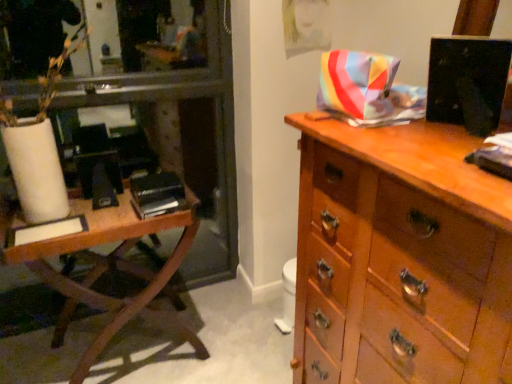
Question: From a real-world perspective, relative to black matte book at left, is white matte vase at left vertically above or below?

Choices:
 (A) below
 (B) above

Answer: (B)

Question: In terms of height, does white matte vase at left look taller or shorter compared to black matte book at left?

Choices:
 (A) tall
 (B) short

Answer: (A)

Question: Estimate the real-world distances between objects in this image. Which object is closer to the white matte vase at left?

Choices:
 (A) wooden chest of drawers at right
 (B) black glossy monitor at upper right
 (C) wooden table at left
 (D) black matte book at left

Answer: (C)

Question: Which object is positioned closest to the black matte book at left?

Choices:
 (A) wooden table at left
 (B) wooden chest of drawers at right
 (C) white matte vase at left
 (D) black glossy monitor at upper right

Answer: (A)